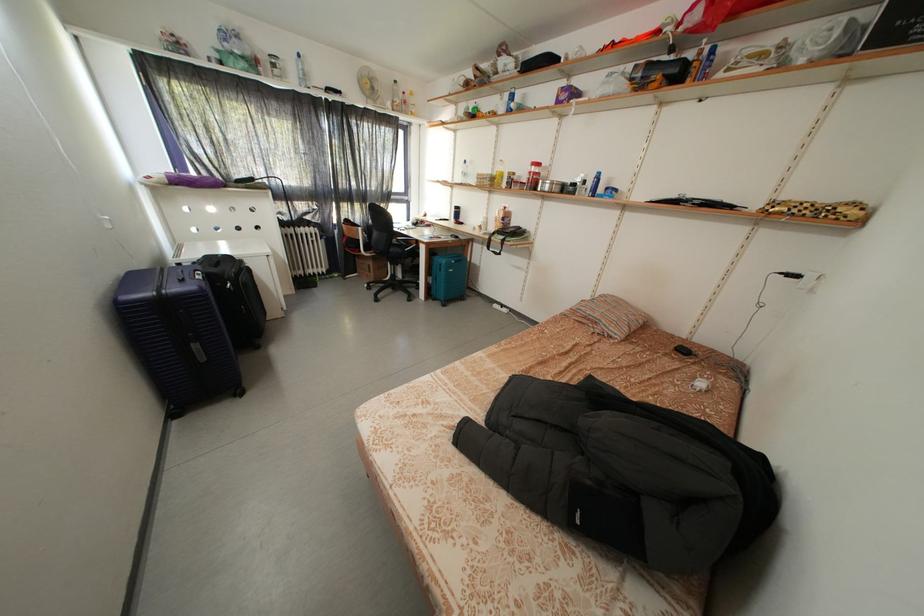
Which object does [476,164] point to?

It refers to a bottle with green cap.